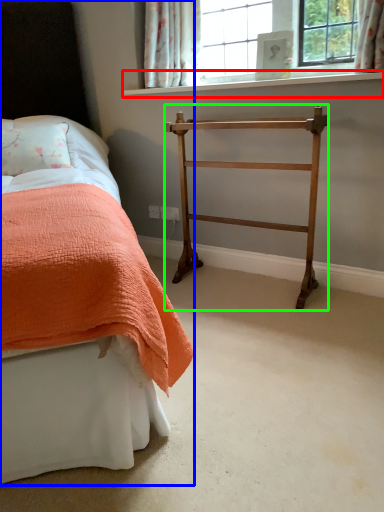
Question: Based on their relative distances, which object is nearer to window sill (highlighted by a red box)? Choose from bed (highlighted by a blue box) and furniture (highlighted by a green box).

Choices:
 (A) bed
 (B) furniture

Answer: (B)